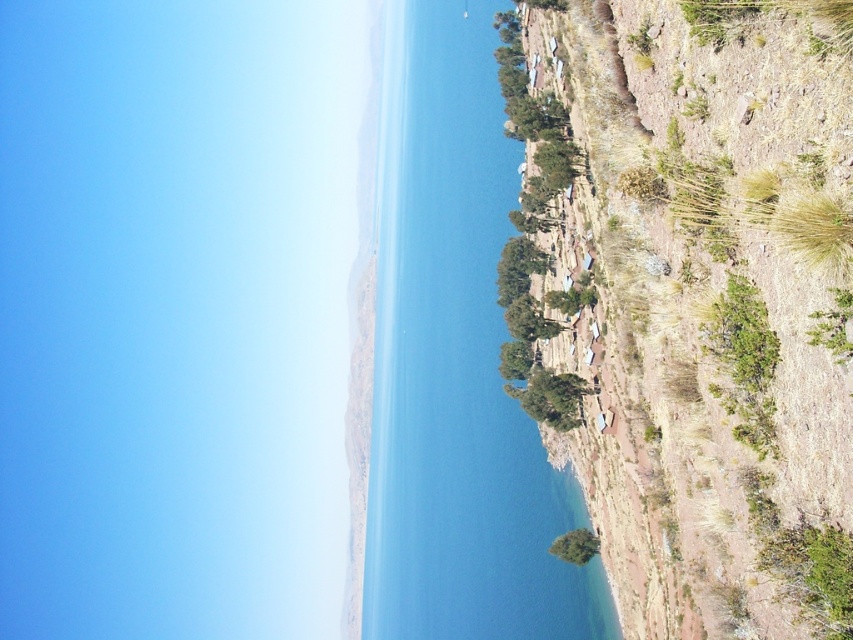
Question: Can you confirm if blue water at center is bigger than green leafy bush at lower center?

Choices:
 (A) yes
 (B) no

Answer: (A)

Question: Does blue water at center appear on the right side of green leafy bush at lower center?

Choices:
 (A) yes
 (B) no

Answer: (B)

Question: Which of the following is the farthest from the observer?

Choices:
 (A) [x=569, y=536]
 (B) [x=461, y=118]

Answer: (B)

Question: Which point is farther to the camera?

Choices:
 (A) blue water at center
 (B) green leafy bush at lower center

Answer: (A)

Question: Which of the following is the closest to the observer?

Choices:
 (A) (590, 532)
 (B) (390, 92)

Answer: (A)

Question: Is blue water at center wider than green leafy bush at lower center?

Choices:
 (A) yes
 (B) no

Answer: (A)